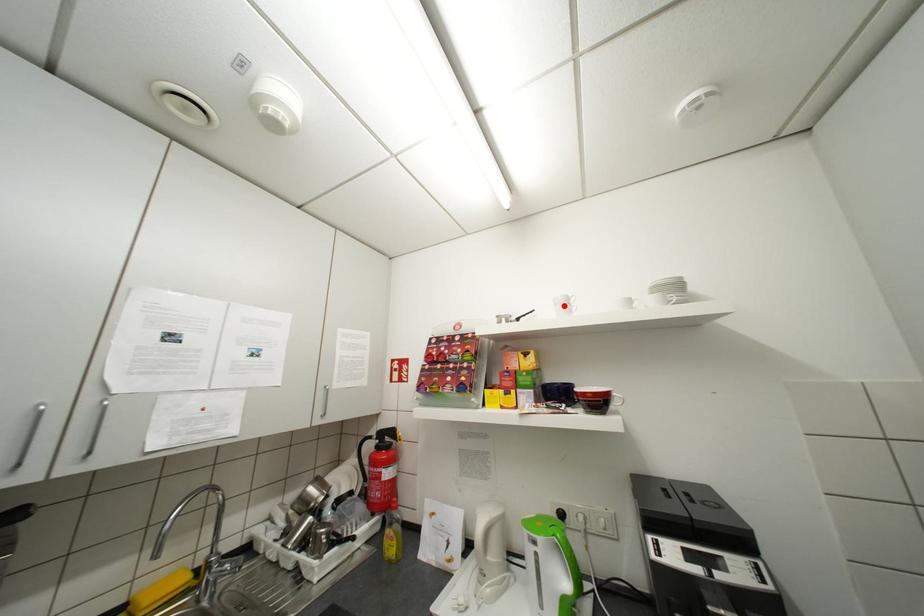
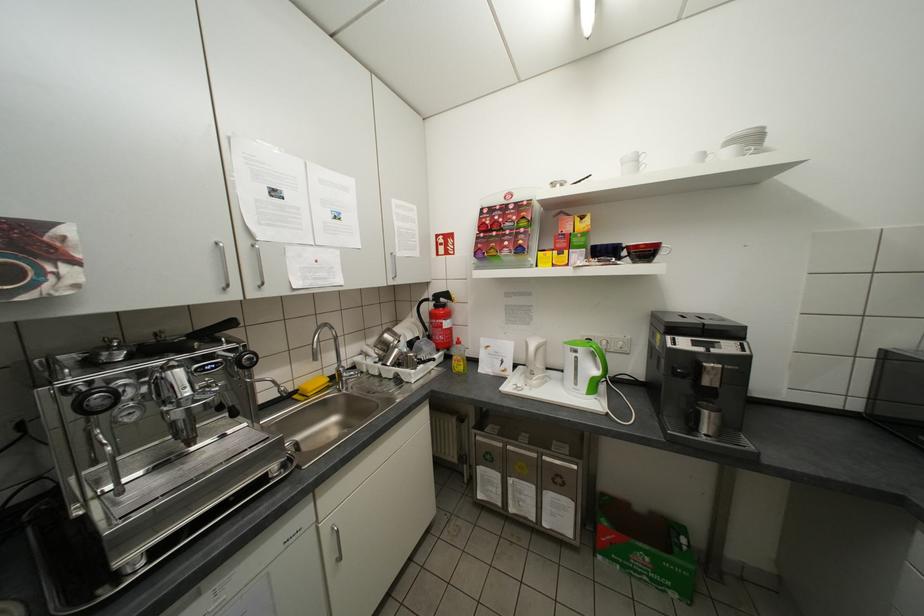
The point at the highlighted location is marked in the first image. Where is the corresponding point in the second image?

(630, 166)